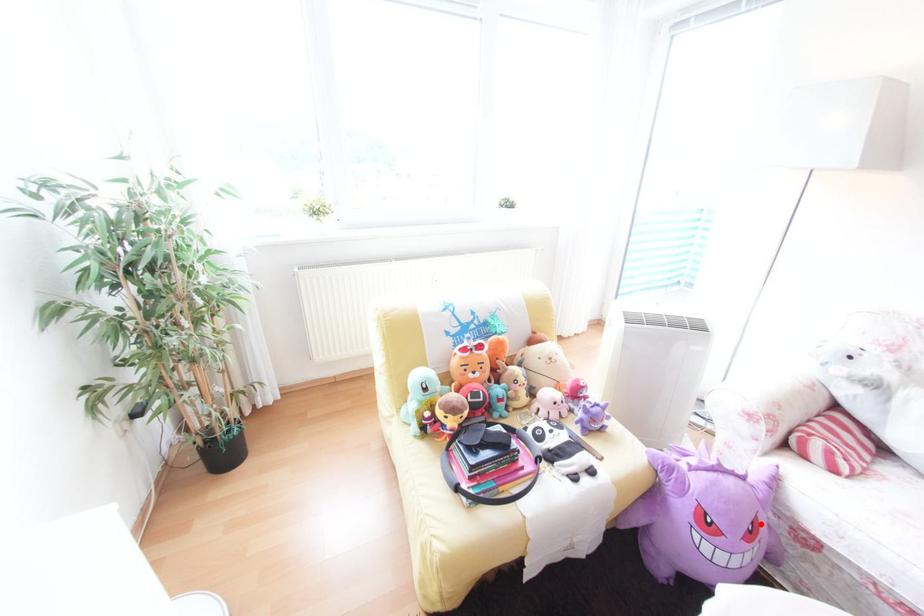
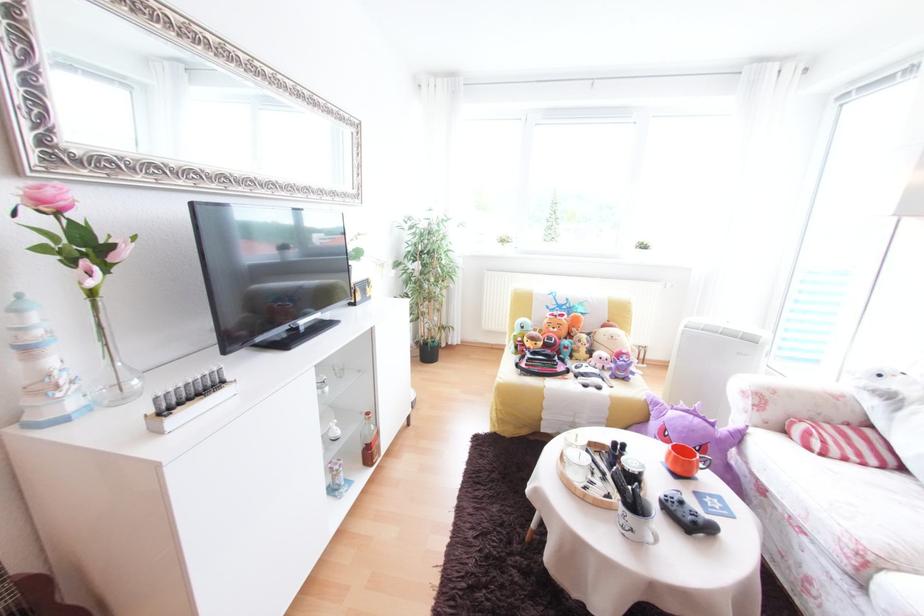
Question: I am providing you with two images of the same scene from different viewpoints. Given a red point in image1, look at the same physical point in image2. Is it:

Choices:
 (A) Closer to the viewpoint
 (B) Farther from the viewpoint

Answer: (B)